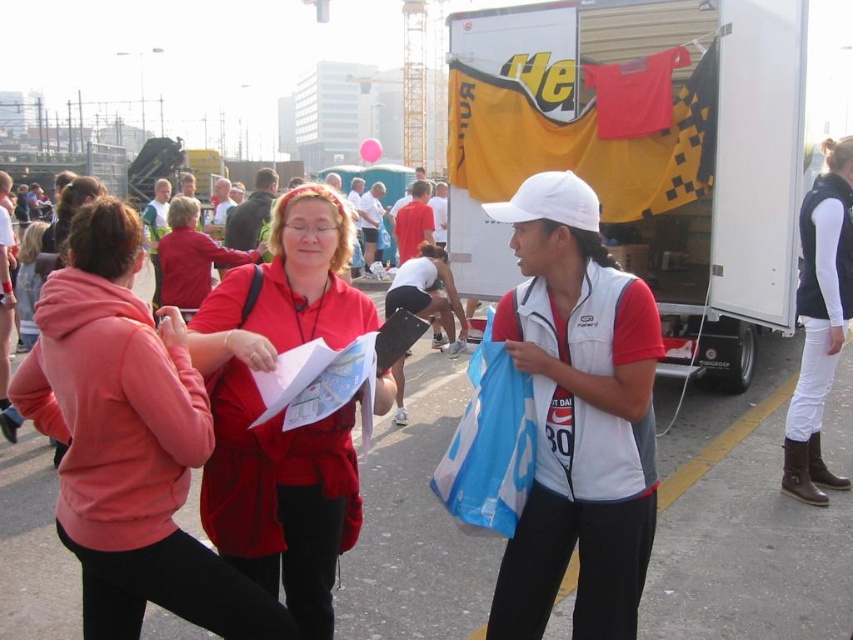
You are standing at the origin point in the scene. Where is the matte red hoodie at center located in relation to you?

The matte red hoodie at center is located at point 0.692 on the x axis and 0.152 on the y axis.

From the picture: You are organizing a community event and need to ensure all participants have the correct gear. You have a limited number of large size items. If the matte red hoodie at center and the white matte vest at center are both available in standard and large sizes, which one is more likely to be in the large size based on their appearance?

The matte red hoodie at center is larger in size compared to the white matte vest at center, so it is more likely to be in the large size.

You are a participant at this event and see both the matte red hoodie at center and the matte red jacket at center. Which one is positioned lower in the image?

The matte red hoodie at center is positioned lower than the matte red jacket at center.